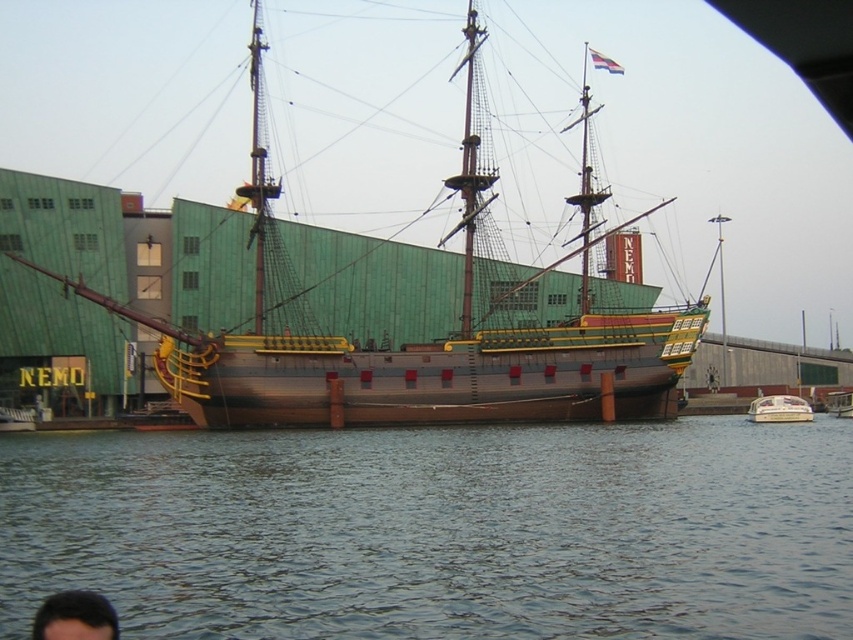
Question: Is dark blue water at lower center positioned behind wooden pirate ship at center?

Choices:
 (A) no
 (B) yes

Answer: (A)

Question: Which object appears closest to the camera in this image?

Choices:
 (A) dark brown hair at lower left
 (B) wooden pirate ship at center

Answer: (A)

Question: Among these objects, which one is nearest to the camera?

Choices:
 (A) dark blue water at lower center
 (B) white plastic boat at lower right

Answer: (A)

Question: Is wooden pirate ship at center below dark brown hair at lower left?

Choices:
 (A) no
 (B) yes

Answer: (A)

Question: Which point is farther to the camera?

Choices:
 (A) (700, 316)
 (B) (82, 604)

Answer: (A)

Question: Does dark brown hair at lower left have a smaller size compared to white plastic boat at lower right?

Choices:
 (A) no
 (B) yes

Answer: (B)